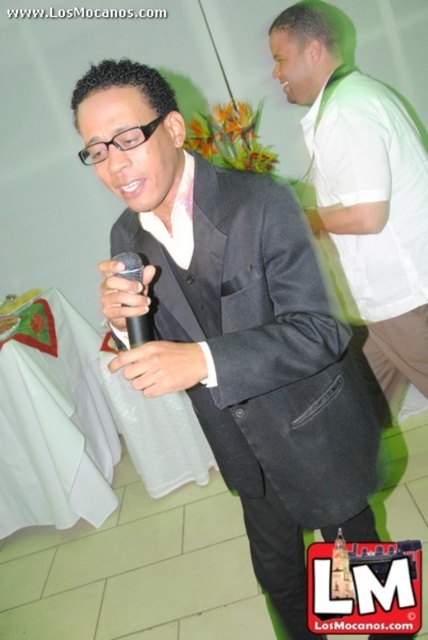
Question: Can you confirm if matte black suit at center is positioned to the right of white matte shirt at upper right?

Choices:
 (A) no
 (B) yes

Answer: (A)

Question: Based on their relative distances, which object is nearer to the matte black suit at center?

Choices:
 (A) white matte shirt at upper right
 (B) black matte microphone at center

Answer: (B)

Question: Which of the following is the farthest from the observer?

Choices:
 (A) matte black suit at center
 (B) white matte shirt at upper right

Answer: (B)

Question: Does white matte shirt at upper right have a smaller size compared to black matte microphone at center?

Choices:
 (A) no
 (B) yes

Answer: (A)

Question: Estimate the real-world distances between objects in this image. Which object is farther from the matte black suit at center?

Choices:
 (A) black matte microphone at center
 (B) white matte shirt at upper right

Answer: (B)

Question: Can you confirm if matte black suit at center is smaller than white matte shirt at upper right?

Choices:
 (A) no
 (B) yes

Answer: (A)